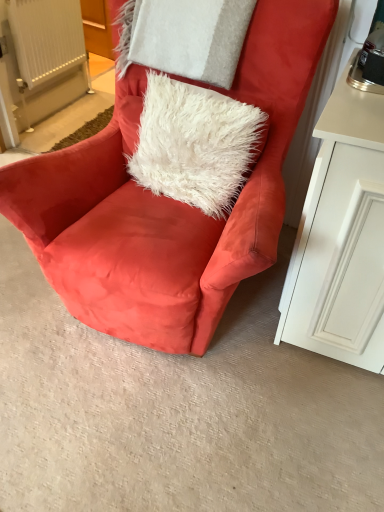
What do you see at coordinates (191, 143) in the screenshot? I see `white fluffy pillow at upper center` at bounding box center [191, 143].

In order to face white fluffy pillow at upper center, should I rotate leftwards or rightwards?

Rotate your view left by about 1.040°.

What do you see at coordinates (46, 38) in the screenshot?
I see `white plastic radiator at upper left` at bounding box center [46, 38].

Locate an element on the screen. The image size is (384, 512). white fluffy pillow at upper center is located at coordinates (184, 37).

Which object is further away from the camera, white fluffy pillow at upper center or suede orange chair at center?

white fluffy pillow at upper center is further away from the camera.

Is white fluffy pillow at upper center not near suede orange chair at center?

Actually, white fluffy pillow at upper center and suede orange chair at center are a little close together.

Is suede orange chair at center inside white fluffy pillow at upper center?

Actually, suede orange chair at center is outside white fluffy pillow at upper center.

Consider the image. Is white fluffy pillow at upper center taller than suede orange chair at center?

No.

Is suede orange chair at center oriented towards white fluffy pillow at upper center?

No, suede orange chair at center does not turn towards white fluffy pillow at upper center.

How much distance is there between suede orange chair at center and white fluffy pillow at upper center?

suede orange chair at center is 15.88 inches from white fluffy pillow at upper center.

Which of these two, suede orange chair at center or white fluffy pillow at upper center, is bigger?

With larger size is suede orange chair at center.

Does point (68, 217) come in front of point (140, 46)?

That is True.

Is white plastic radiator at upper left touching white fluffy pillow at upper center?

No, white plastic radiator at upper left is not beside white fluffy pillow at upper center.

Looking at this image, is white plastic radiator at upper left turned away from white fluffy pillow at upper center?

That's not correct — white plastic radiator at upper left is not looking away from white fluffy pillow at upper center.

Is white plastic radiator at upper left inside the boundaries of white fluffy pillow at upper center, or outside?

white plastic radiator at upper left lies outside white fluffy pillow at upper center.

Does white plastic radiator at upper left come behind white fluffy pillow at upper center?

That is True.

Is suede orange chair at center bigger or smaller than white plastic radiator at upper left?

Considering their sizes, suede orange chair at center takes up more space than white plastic radiator at upper left.

Are suede orange chair at center and white plastic radiator at upper left located far from each other?

Absolutely, suede orange chair at center is distant from white plastic radiator at upper left.

Where is `chair lying on the right of white plastic radiator at upper left`? This screenshot has width=384, height=512. chair lying on the right of white plastic radiator at upper left is located at coordinates (168, 203).

Is suede orange chair at center to the left or to the right of white plastic radiator at upper left in the image?

Based on their positions, suede orange chair at center is located to the right of white plastic radiator at upper left.

Identify the location of throw pillow behind the suede orange chair at center. The height and width of the screenshot is (512, 384). (191, 143).

Measure the distance between suede orange chair at center and white fluffy pillow at upper center.

A distance of 6.98 inches exists between suede orange chair at center and white fluffy pillow at upper center.

Does point (274, 1) lie behind point (190, 128)?

No, it is not.

How different are the orientations of suede orange chair at center and white fluffy pillow at upper center in degrees?

They differ by 10.4 degrees in their facing directions.

Would you say white fluffy pillow at upper center is inside or outside white fluffy pillow at upper center?

white fluffy pillow at upper center is located beyond the bounds of white fluffy pillow at upper center.

Is point (205, 42) behind point (189, 168)?

That is False.

Is white fluffy pillow at upper center wider than white fluffy pillow at upper center?

In fact, white fluffy pillow at upper center might be narrower than white fluffy pillow at upper center.

Image resolution: width=384 pixels, height=512 pixels. I want to click on throw pillow below the white fluffy pillow at upper center (from a real-world perspective), so click(191, 143).

Is the depth of white fluffy pillow at upper center less than that of white fluffy pillow at upper center?

Yes, the depth of white fluffy pillow at upper center is less than that of white fluffy pillow at upper center.

Considering the relative sizes of white fluffy pillow at upper center and white fluffy pillow at upper center in the image provided, is white fluffy pillow at upper center taller than white fluffy pillow at upper center?

Indeed, white fluffy pillow at upper center has a greater height compared to white fluffy pillow at upper center.

In terms of size, does white fluffy pillow at upper center appear bigger or smaller than white fluffy pillow at upper center?

white fluffy pillow at upper center is bigger than white fluffy pillow at upper center.

Is white fluffy pillow at upper center positioned beyond the bounds of white fluffy pillow at upper center?

Yes, white fluffy pillow at upper center is not within white fluffy pillow at upper center.

Where is `pillow that appears above the suede orange chair at center (from the image's perspective)`? This screenshot has width=384, height=512. pillow that appears above the suede orange chair at center (from the image's perspective) is located at coordinates (184, 37).

Find the location of `pillow on the right of suede orange chair at center`. pillow on the right of suede orange chair at center is located at coordinates tap(184, 37).

In the scene shown: Considering their positions, is white plastic radiator at upper left positioned further to white fluffy pillow at upper center than white fluffy pillow at upper center?

white plastic radiator at upper left lies further to white fluffy pillow at upper center than the other object.

Which object lies nearer to the anchor point white fluffy pillow at upper center, white fluffy pillow at upper center or white plastic radiator at upper left?

white fluffy pillow at upper center is positioned closer to the anchor white fluffy pillow at upper center.

Considering their positions, is white fluffy pillow at upper center positioned closer to white plastic radiator at upper left than suede orange chair at center?

Based on the image, white fluffy pillow at upper center appears to be nearer to white plastic radiator at upper left.

Considering their positions, is white fluffy pillow at upper center positioned closer to white fluffy pillow at upper center than suede orange chair at center?

suede orange chair at center.

Estimate the real-world distances between objects in this image. Which object is closer to suede orange chair at center, white plastic radiator at upper left or white fluffy pillow at upper center?

white fluffy pillow at upper center is positioned closer to the anchor suede orange chair at center.

From the image, which object appears to be farther from white fluffy pillow at upper center, white fluffy pillow at upper center or white plastic radiator at upper left?

Among the two, white plastic radiator at upper left is located further to white fluffy pillow at upper center.

When comparing their distances from white fluffy pillow at upper center, does white plastic radiator at upper left or suede orange chair at center seem further?

white plastic radiator at upper left is positioned further to the anchor white fluffy pillow at upper center.

Considering their positions, is suede orange chair at center positioned further to white fluffy pillow at upper center than white plastic radiator at upper left?

white plastic radiator at upper left.

Image resolution: width=384 pixels, height=512 pixels. What are the coordinates of `pillow located between suede orange chair at center and white plastic radiator at upper left in the depth direction` in the screenshot? It's located at (184, 37).

Where is `pillow between white fluffy pillow at upper center and white plastic radiator at upper left in the front-back direction`? pillow between white fluffy pillow at upper center and white plastic radiator at upper left in the front-back direction is located at coordinates (184, 37).

Identify the location of throw pillow between suede orange chair at center and white plastic radiator at upper left from front to back. The height and width of the screenshot is (512, 384). (191, 143).

The width and height of the screenshot is (384, 512). Identify the location of throw pillow between suede orange chair at center and white fluffy pillow at upper center along the z-axis. (191, 143).